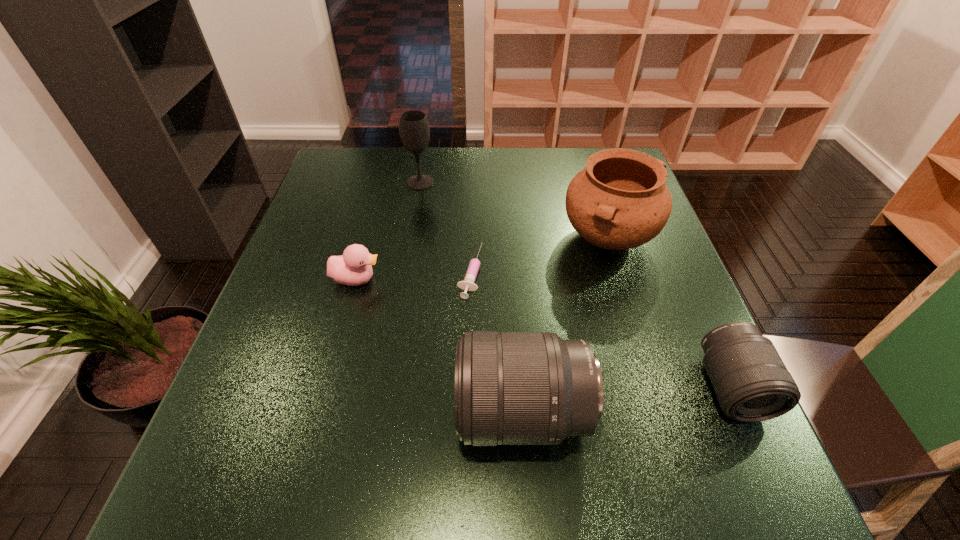
The image size is (960, 540). I want to click on free space for a new telephoto lens on the left, so click(x=293, y=442).